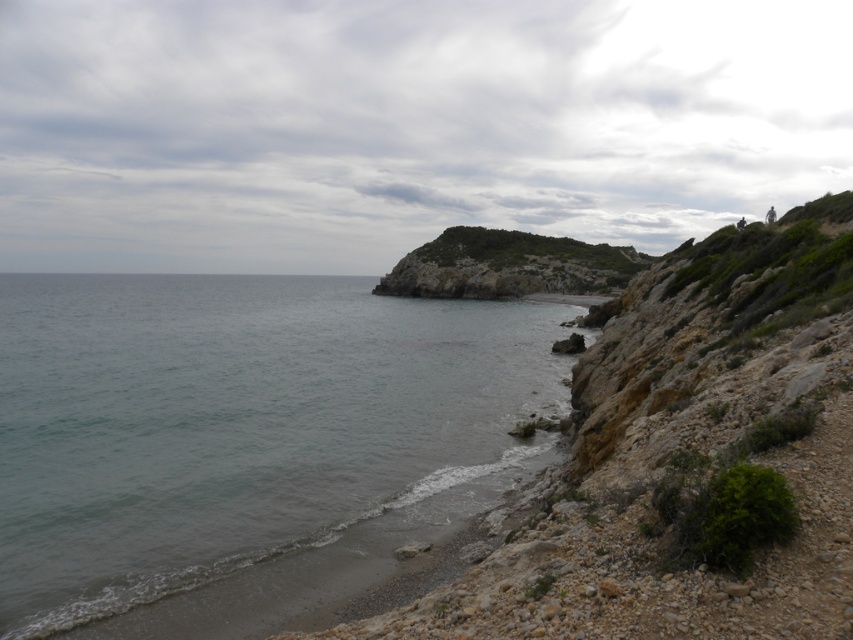
Does clear water at lower left lie in front of green rocky hillside at center?

Yes.

Is clear water at lower left wider than green rocky hillside at center?

Indeed, clear water at lower left has a greater width compared to green rocky hillside at center.

Who is more forward, (221,301) or (610,282)?

Point (221,301)

The height and width of the screenshot is (640, 853). Identify the location of clear water at lower left. (242, 442).